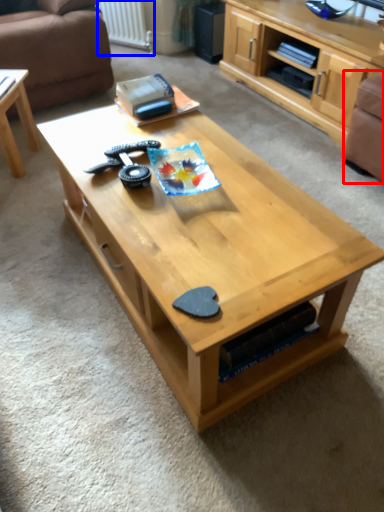
Question: Which point is further to the camera, armchair (highlighted by a red box) or radiator (highlighted by a blue box)?

Choices:
 (A) armchair
 (B) radiator

Answer: (B)